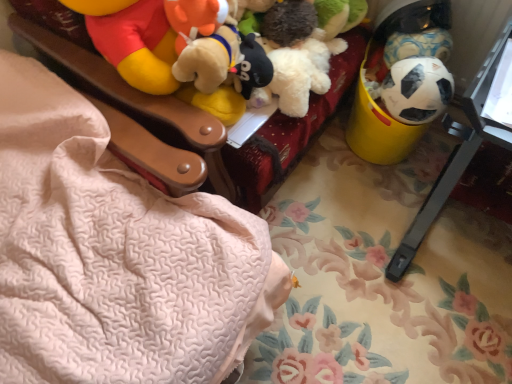
Question: From the image's perspective, would you say yellow plastic changing table at right is positioned over black matte soccer ball at right, the 1th toy positioned from the bottom?

Choices:
 (A) no
 (B) yes

Answer: (A)

Question: Considering the relative sizes of yellow plastic changing table at right and black matte soccer ball at right, arranged as the second toy when viewed from the top, in the image provided, is yellow plastic changing table at right wider than black matte soccer ball at right, arranged as the second toy when viewed from the top,?

Choices:
 (A) yes
 (B) no

Answer: (A)

Question: Is yellow plastic changing table at right located outside black matte soccer ball at right, the 1th toy positioned from the bottom?

Choices:
 (A) yes
 (B) no

Answer: (A)

Question: Can you confirm if yellow plastic changing table at right is thinner than black matte soccer ball at right, arranged as the second toy when viewed from the top?

Choices:
 (A) no
 (B) yes

Answer: (A)

Question: Does yellow plastic changing table at right lie behind black matte soccer ball at right, arranged as the second toy when viewed from the top?

Choices:
 (A) yes
 (B) no

Answer: (B)

Question: Considering the relative positions of yellow plastic bucket at right and black matte soccer ball at right, the 1th toy positioned from the bottom, in the image provided, is yellow plastic bucket at right to the left or to the right of black matte soccer ball at right, the 1th toy positioned from the bottom,?

Choices:
 (A) right
 (B) left

Answer: (B)

Question: From the image's perspective, relative to black matte soccer ball at right, the 1th toy positioned from the bottom, is yellow plastic bucket at right above or below?

Choices:
 (A) above
 (B) below

Answer: (A)

Question: Is yellow plastic bucket at right inside or outside of black matte soccer ball at right, the 1th toy positioned from the bottom?

Choices:
 (A) outside
 (B) inside

Answer: (A)

Question: Considering their positions, is yellow plastic bucket at right located in front of or behind black matte soccer ball at right, arranged as the second toy when viewed from the top?

Choices:
 (A) behind
 (B) front

Answer: (B)

Question: Considering the positions of white matte soccer ball at right, which is the first toy in top-to-bottom order, and yellow plastic changing table at right in the image, is white matte soccer ball at right, which is the first toy in top-to-bottom order, wider or thinner than yellow plastic changing table at right?

Choices:
 (A) thin
 (B) wide

Answer: (A)

Question: From their relative heights in the image, would you say white matte soccer ball at right, placed as the second toy when sorted from bottom to top, is taller or shorter than yellow plastic changing table at right?

Choices:
 (A) short
 (B) tall

Answer: (A)

Question: From the image's perspective, is white matte soccer ball at right, which is the first toy in top-to-bottom order, above or below yellow plastic changing table at right?

Choices:
 (A) above
 (B) below

Answer: (A)

Question: From a real-world perspective, is white matte soccer ball at right, which is the first toy in top-to-bottom order, above or below yellow plastic changing table at right?

Choices:
 (A) above
 (B) below

Answer: (A)

Question: Considering the positions of point (441, 100) and point (31, 9), is point (441, 100) closer or farther from the camera than point (31, 9)?

Choices:
 (A) farther
 (B) closer

Answer: (B)

Question: Visually, is black matte soccer ball at right, arranged as the second toy when viewed from the top, positioned to the left or to the right of yellow plastic bucket at right?

Choices:
 (A) right
 (B) left

Answer: (A)